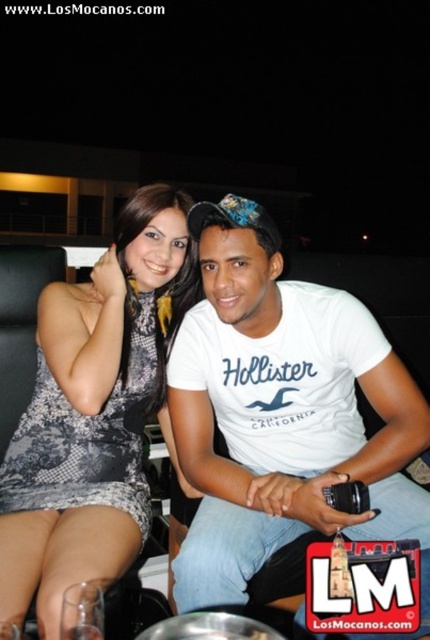
Question: Which object appears farthest from the camera in this image?

Choices:
 (A) white cotton t-shirt at center
 (B) black lace dress at center

Answer: (A)

Question: Considering the relative positions of white cotton t-shirt at center and black lace dress at center in the image provided, where is white cotton t-shirt at center located with respect to black lace dress at center?

Choices:
 (A) below
 (B) above

Answer: (A)

Question: Does white cotton t-shirt at center have a smaller size compared to black lace dress at center?

Choices:
 (A) no
 (B) yes

Answer: (A)

Question: Can you confirm if white cotton t-shirt at center is wider than black lace dress at center?

Choices:
 (A) no
 (B) yes

Answer: (B)

Question: Among these points, which one is farthest from the camera?

Choices:
 (A) (334, 458)
 (B) (57, 448)

Answer: (A)